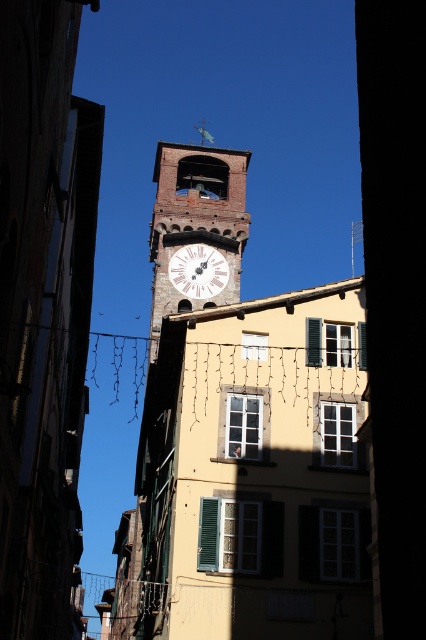
Consider the image. Who is taller, white painted stone clock tower at center or white wooden clock at center?

white painted stone clock tower at center

Does point (236, 285) lie in front of point (169, 262)?

That is True.

Find the location of a particular element. The width and height of the screenshot is (426, 640). white painted stone clock tower at center is located at coordinates (195, 228).